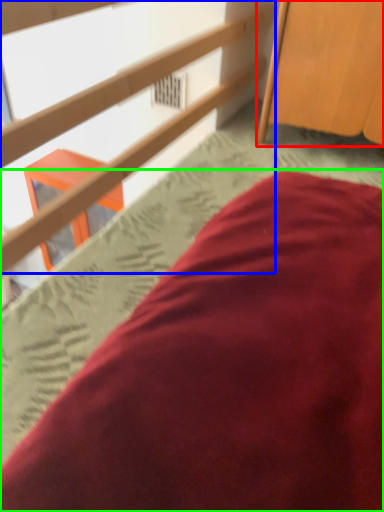
Question: Which object is positioned closest to furniture (highlighted by a red box)? Select from rail (highlighted by a blue box) and bed (highlighted by a green box).

Choices:
 (A) rail
 (B) bed

Answer: (A)